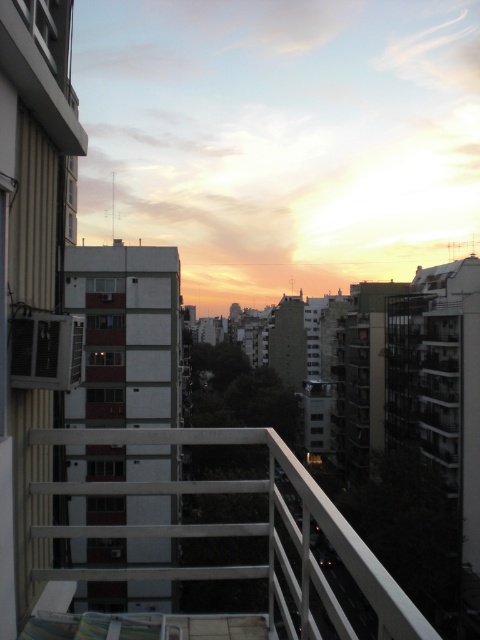
Is point (240, 484) positioned before point (52, 384)?

That is False.

Is white metal railing at center closer to the viewer compared to matte white balcony at lower left?

Yes, it is.

Where is `white metal railing at center`? white metal railing at center is located at coordinates (240, 532).